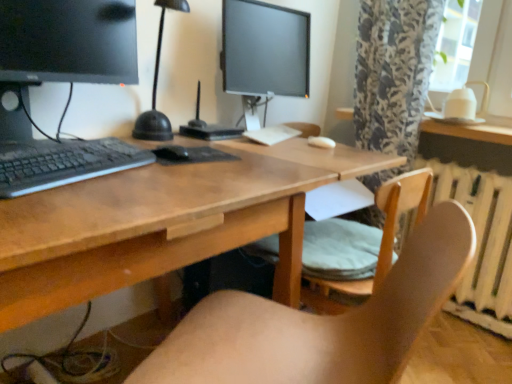
This screenshot has height=384, width=512. Identify the location of empty space that is to the right of black matte mouse at center. (237, 161).